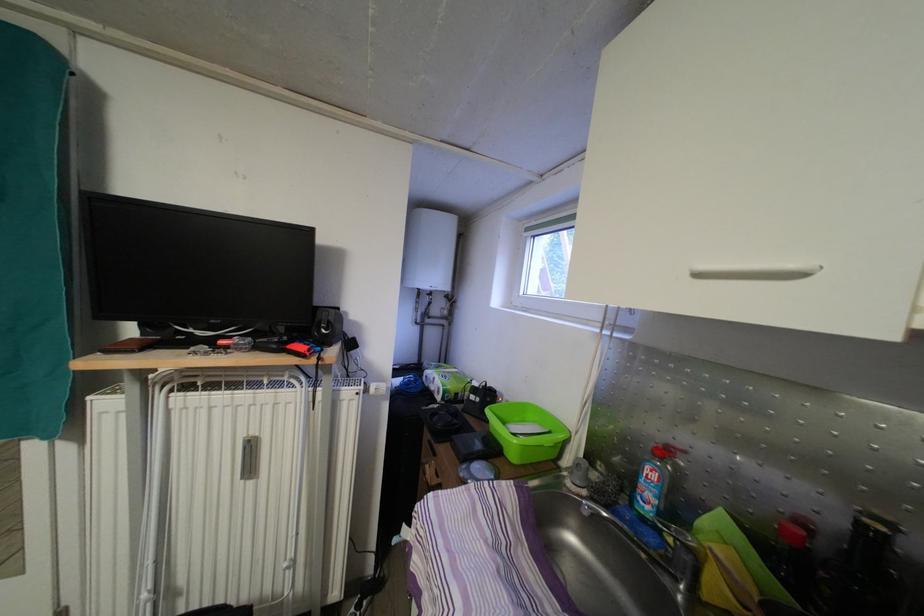
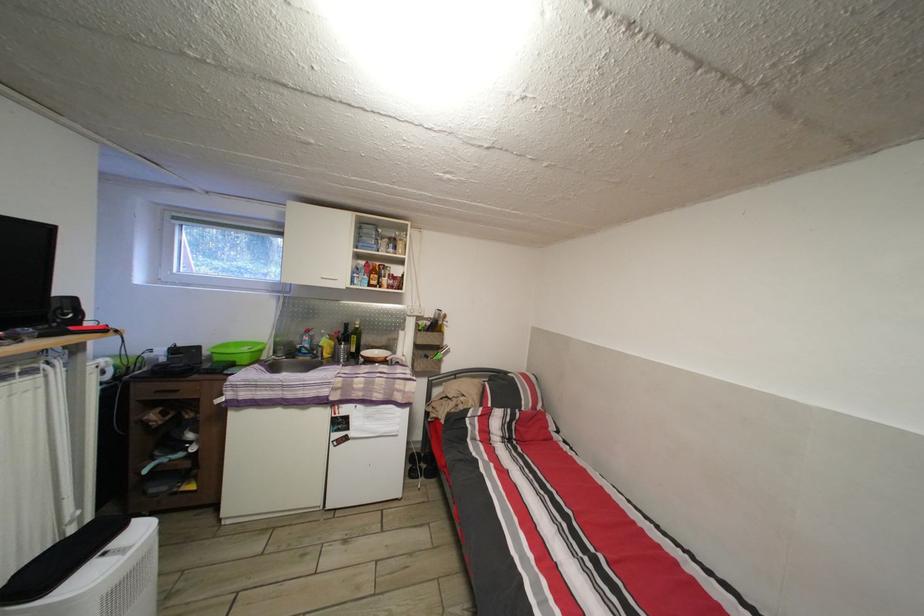
Locate, in the second image, the point that corresponds to [442,461] in the first image.

(184, 398)